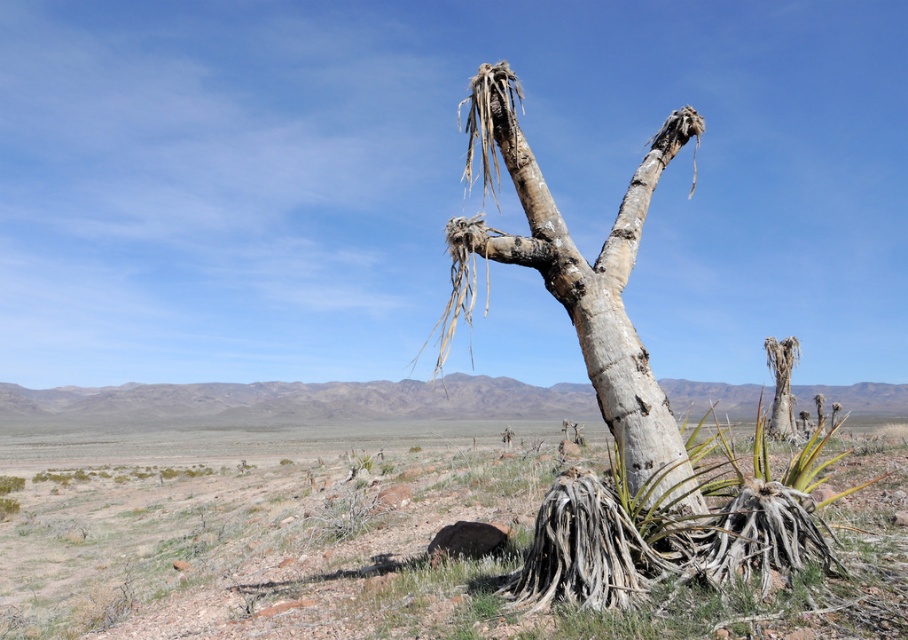
Who is positioned more to the left, desert soil at center or gray bark tree at center?

From the viewer's perspective, desert soil at center appears more on the left side.

Who is shorter, desert soil at center or gray bark tree at center?

Standing shorter between the two is desert soil at center.

Locate an element on the screen. desert soil at center is located at coordinates (393, 554).